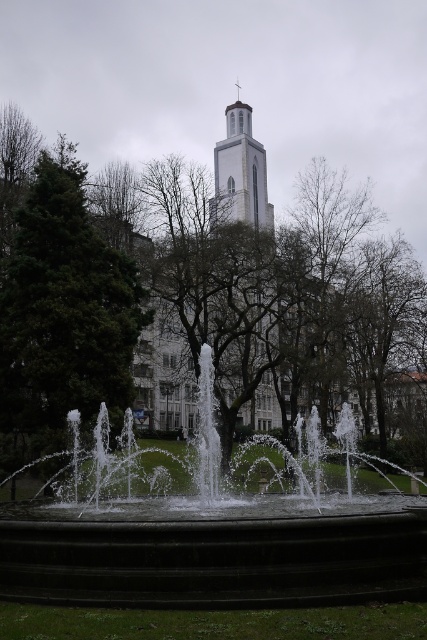
Is point (242, 520) more distant than point (242, 134)?

No, (242, 520) is in front of (242, 134).

Who is more forward, [216,564] or [266,422]?

Point [216,564]

Is point (379, 586) farther from camera compared to point (254, 184)?

That is False.

Where is `white stone fountain at center`? white stone fountain at center is located at coordinates (216, 561).

Is white stone tower at center to the right of white stone bell tower at center from the viewer's perspective?

Yes, white stone tower at center is to the right of white stone bell tower at center.

Does white stone tower at center have a lesser width compared to white stone bell tower at center?

In fact, white stone tower at center might be wider than white stone bell tower at center.

Is point (216, 170) farther from viewer compared to point (245, 122)?

No, it is in front of (245, 122).

Locate an element on the screen. The width and height of the screenshot is (427, 640). white stone tower at center is located at coordinates (240, 172).

Is green textured tree at left to the right of white stone tower at center from the viewer's perspective?

Incorrect, green textured tree at left is not on the right side of white stone tower at center.

Which is above, green textured tree at left or white stone tower at center?

white stone tower at center

Locate an element on the screen. The height and width of the screenshot is (640, 427). green textured tree at left is located at coordinates (61, 316).

This screenshot has height=640, width=427. What are the coordinates of `green textured tree at left` in the screenshot? It's located at (61, 316).